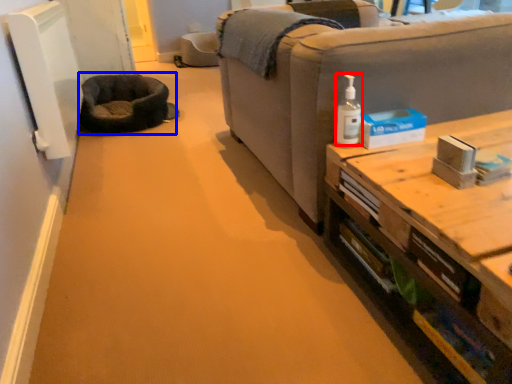
Question: Which object appears closest to the camera in this image, toiletry (highlighted by a red box) or cat bed (highlighted by a blue box)?

Choices:
 (A) toiletry
 (B) cat bed

Answer: (A)